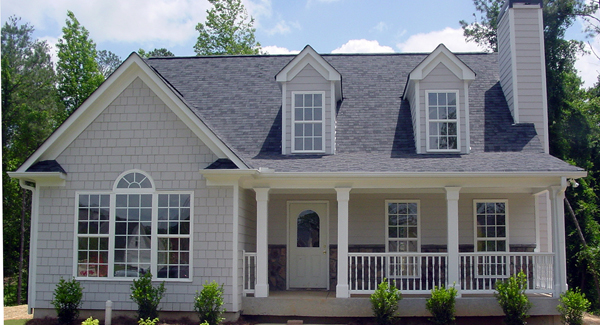
Find the location of `windows`. windows is located at coordinates (92, 243), (130, 243), (173, 243), (133, 179), (312, 127), (445, 125), (407, 220), (481, 220), (312, 240).